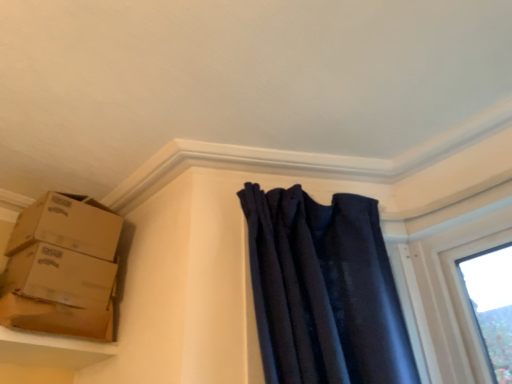
In the scene shown: What is the approximate height of brown cardboard boxes at left, the first box when ordered from bottom to top?

18.68 centimeters.

Where is `brown cardboard boxes at left, the first box when ordered from bottom to top`? The height and width of the screenshot is (384, 512). brown cardboard boxes at left, the first box when ordered from bottom to top is located at coordinates (58, 293).

Looking at this image, between smooth beige shelf at lower left and brown cardboard boxes at left, marked as the 2th box in a top-to-bottom arrangement, which one has smaller width?

With smaller width is brown cardboard boxes at left, marked as the 2th box in a top-to-bottom arrangement.

Considering the sizes of objects smooth beige shelf at lower left and brown cardboard boxes at left, the first box when ordered from bottom to top, in the image provided, who is taller, smooth beige shelf at lower left or brown cardboard boxes at left, the first box when ordered from bottom to top,?

Standing taller between the two is brown cardboard boxes at left, the first box when ordered from bottom to top.

From the image's perspective, is smooth beige shelf at lower left positioned above or below brown cardboard boxes at left, marked as the 2th box in a top-to-bottom arrangement?

smooth beige shelf at lower left is below brown cardboard boxes at left, marked as the 2th box in a top-to-bottom arrangement.

Is smooth beige shelf at lower left bigger than brown cardboard boxes at left, the first box when ordered from bottom to top?

No, smooth beige shelf at lower left is not bigger than brown cardboard boxes at left, the first box when ordered from bottom to top.

Is brown cardboard boxes at left, marked as the 2th box in a top-to-bottom arrangement, to the left of brown cardboard box at left from the viewer's perspective?

Yes, brown cardboard boxes at left, marked as the 2th box in a top-to-bottom arrangement, is to the left of brown cardboard box at left.

Is point (16, 315) positioned behind point (10, 328)?

Yes, it is behind point (10, 328).

Which object is further away from the camera taking this photo, brown cardboard boxes at left, marked as the 2th box in a top-to-bottom arrangement, or brown cardboard box at left?

brown cardboard boxes at left, marked as the 2th box in a top-to-bottom arrangement, is further away from the camera.

Does brown cardboard boxes at upper left, which is the first box from top to bottom, contain smooth beige shelf at lower left?

That's incorrect, smooth beige shelf at lower left is not inside brown cardboard boxes at upper left, which is the first box from top to bottom.

Can you confirm if brown cardboard boxes at upper left, which is the first box from top to bottom, is wider than smooth beige shelf at lower left?

Correct, the width of brown cardboard boxes at upper left, which is the first box from top to bottom, exceeds that of smooth beige shelf at lower left.

Is point (106, 219) less distant than point (113, 352)?

No, (106, 219) is further to viewer.

Can you confirm if brown cardboard boxes at upper left, the 2th box in the bottom-to-top sequence, is bigger than smooth beige shelf at lower left?

Indeed, brown cardboard boxes at upper left, the 2th box in the bottom-to-top sequence, has a larger size compared to smooth beige shelf at lower left.

Does smooth beige shelf at lower left come behind brown cardboard boxes at upper left, the 2th box in the bottom-to-top sequence?

That is False.

Is smooth beige shelf at lower left far away from brown cardboard boxes at upper left, the 2th box in the bottom-to-top sequence?

They are positioned close to each other.

Considering the sizes of objects smooth beige shelf at lower left and brown cardboard boxes at upper left, which is the first box from top to bottom, in the image provided, who is shorter, smooth beige shelf at lower left or brown cardboard boxes at upper left, which is the first box from top to bottom,?

smooth beige shelf at lower left is shorter.

Which object is wider, smooth beige shelf at lower left or brown cardboard boxes at upper left, the 2th box in the bottom-to-top sequence?

brown cardboard boxes at upper left, the 2th box in the bottom-to-top sequence.

Is brown cardboard box at left further to the viewer compared to smooth beige shelf at lower left?

Yes, the depth of brown cardboard box at left is greater than that of smooth beige shelf at lower left.

How much distance is there between brown cardboard box at left and smooth beige shelf at lower left?

The distance of brown cardboard box at left from smooth beige shelf at lower left is 1.75 inches.

Who is bigger, brown cardboard box at left or smooth beige shelf at lower left?

With larger size is smooth beige shelf at lower left.

Is brown cardboard box at left situated inside smooth beige shelf at lower left or outside?

brown cardboard box at left is located beyond the bounds of smooth beige shelf at lower left.

Does point (102, 261) appear closer or farther from the camera than point (57, 344)?

Point (102, 261) appears to be farther away from the viewer than point (57, 344).

From the image's perspective, is brown cardboard boxes at left, marked as the 2th box in a top-to-bottom arrangement, on smooth beige shelf at lower left?

Yes, from the image's perspective, brown cardboard boxes at left, marked as the 2th box in a top-to-bottom arrangement, is on top of smooth beige shelf at lower left.

Considering the relative positions of brown cardboard boxes at left, marked as the 2th box in a top-to-bottom arrangement, and smooth beige shelf at lower left in the image provided, is brown cardboard boxes at left, marked as the 2th box in a top-to-bottom arrangement, to the left of smooth beige shelf at lower left from the viewer's perspective?

In fact, brown cardboard boxes at left, marked as the 2th box in a top-to-bottom arrangement, is to the right of smooth beige shelf at lower left.

From the picture: Is brown cardboard boxes at left, marked as the 2th box in a top-to-bottom arrangement, oriented towards smooth beige shelf at lower left?

No, brown cardboard boxes at left, marked as the 2th box in a top-to-bottom arrangement, is not oriented towards smooth beige shelf at lower left.

Between brown cardboard boxes at upper left, the 2th box in the bottom-to-top sequence, and brown cardboard box at left, which one has larger width?

Wider between the two is brown cardboard boxes at upper left, the 2th box in the bottom-to-top sequence.

How far apart are brown cardboard boxes at upper left, the 2th box in the bottom-to-top sequence, and brown cardboard box at left?

A distance of 10.21 inches exists between brown cardboard boxes at upper left, the 2th box in the bottom-to-top sequence, and brown cardboard box at left.

From the image's perspective, starting from the brown cardboard box at left, which box is the 2nd one above? Please provide its 2D coordinates.

[(68, 225)]

Is point (91, 246) in front of point (93, 332)?

No, it is not.

This screenshot has width=512, height=384. I want to click on the 1st box positioned above the smooth beige shelf at lower left (from the image's perspective), so click(58, 293).

What are the coordinates of `cardboard box in front of the brown cardboard boxes at left, the first box when ordered from bottom to top` in the screenshot? It's located at (56, 318).

In the scene shown: Which object lies nearer to the anchor point smooth beige shelf at lower left, brown cardboard boxes at left, the first box when ordered from bottom to top, or brown cardboard box at left?

brown cardboard box at left.

Considering their positions, is brown cardboard boxes at upper left, the 2th box in the bottom-to-top sequence, positioned further to brown cardboard boxes at left, marked as the 2th box in a top-to-bottom arrangement, than smooth beige shelf at lower left?

brown cardboard boxes at upper left, the 2th box in the bottom-to-top sequence, lies further to brown cardboard boxes at left, marked as the 2th box in a top-to-bottom arrangement, than the other object.

From the image, which object appears to be farther from brown cardboard boxes at upper left, the 2th box in the bottom-to-top sequence, smooth beige shelf at lower left or brown cardboard box at left?

Based on the image, smooth beige shelf at lower left appears to be further to brown cardboard boxes at upper left, the 2th box in the bottom-to-top sequence.

Based on their spatial positions, is brown cardboard boxes at left, the first box when ordered from bottom to top, or brown cardboard box at left further from brown cardboard boxes at upper left, the 2th box in the bottom-to-top sequence?

brown cardboard box at left is further to brown cardboard boxes at upper left, the 2th box in the bottom-to-top sequence.

From the image, which object appears to be farther from brown cardboard box at left, brown cardboard boxes at left, the first box when ordered from bottom to top, or smooth beige shelf at lower left?

smooth beige shelf at lower left is further to brown cardboard box at left.

When comparing their distances from smooth beige shelf at lower left, does brown cardboard box at left or brown cardboard boxes at left, marked as the 2th box in a top-to-bottom arrangement, seem further?

brown cardboard boxes at left, marked as the 2th box in a top-to-bottom arrangement, is positioned further to the anchor smooth beige shelf at lower left.

Looking at the image, which one is located further to brown cardboard box at left, brown cardboard boxes at upper left, the 2th box in the bottom-to-top sequence, or brown cardboard boxes at left, marked as the 2th box in a top-to-bottom arrangement?

brown cardboard boxes at upper left, the 2th box in the bottom-to-top sequence.

From the image, which object appears to be nearer to smooth beige shelf at lower left, brown cardboard box at left or brown cardboard boxes at upper left, the 2th box in the bottom-to-top sequence?

The object closer to smooth beige shelf at lower left is brown cardboard box at left.

Image resolution: width=512 pixels, height=384 pixels. What are the coordinates of `cardboard box between brown cardboard boxes at upper left, which is the first box from top to bottom, and smooth beige shelf at lower left from top to bottom` in the screenshot? It's located at (56, 318).

Identify the location of box between brown cardboard boxes at upper left, the 2th box in the bottom-to-top sequence, and smooth beige shelf at lower left, in the vertical direction. (58, 293).

This screenshot has width=512, height=384. Identify the location of box between brown cardboard boxes at upper left, which is the first box from top to bottom, and brown cardboard box at left, in the vertical direction. (58, 293).

You are a GUI agent. You are given a task and a screenshot of the screen. Output one action in this format:
    pyautogui.click(x=<x>, y=<y>)
    Task: Click on the cardboard box between brown cardboard boxes at left, the first box when ordered from bottom to top, and smooth beige shelf at lower left from top to bottom
    This screenshot has width=512, height=384.
    Given the screenshot: What is the action you would take?
    pyautogui.click(x=56, y=318)